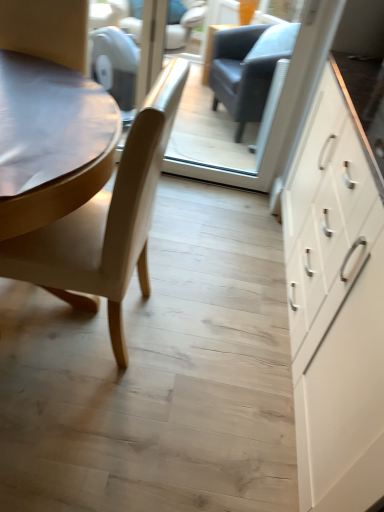
Question: Is white matte cabinet at right further to camera compared to transparent glass door at center?

Choices:
 (A) yes
 (B) no

Answer: (B)

Question: Is white matte cabinet at right shorter than transparent glass door at center?

Choices:
 (A) yes
 (B) no

Answer: (B)

Question: Can you confirm if white matte cabinet at right is taller than transparent glass door at center?

Choices:
 (A) yes
 (B) no

Answer: (A)

Question: Is transparent glass door at center at the back of white matte cabinet at right?

Choices:
 (A) yes
 (B) no

Answer: (B)

Question: Does white matte cabinet at right have a greater width compared to transparent glass door at center?

Choices:
 (A) yes
 (B) no

Answer: (A)

Question: Can you confirm if white matte cabinet at right is positioned to the left of transparent glass door at center?

Choices:
 (A) yes
 (B) no

Answer: (B)

Question: Is transparent glass door at center shorter than light beige leather chair at left?

Choices:
 (A) yes
 (B) no

Answer: (B)

Question: Can you confirm if transparent glass door at center is wider than light beige leather chair at left?

Choices:
 (A) no
 (B) yes

Answer: (A)

Question: From a real-world perspective, is transparent glass door at center on light beige leather chair at left?

Choices:
 (A) no
 (B) yes

Answer: (B)

Question: Does transparent glass door at center have a greater height compared to light beige leather chair at left?

Choices:
 (A) no
 (B) yes

Answer: (B)

Question: From the image's perspective, is transparent glass door at center located above light beige leather chair at left?

Choices:
 (A) no
 (B) yes

Answer: (B)

Question: Is transparent glass door at center with light beige leather chair at left?

Choices:
 (A) yes
 (B) no

Answer: (B)

Question: Is light beige leather chair at left facing away from transparent glass door at center?

Choices:
 (A) yes
 (B) no

Answer: (B)